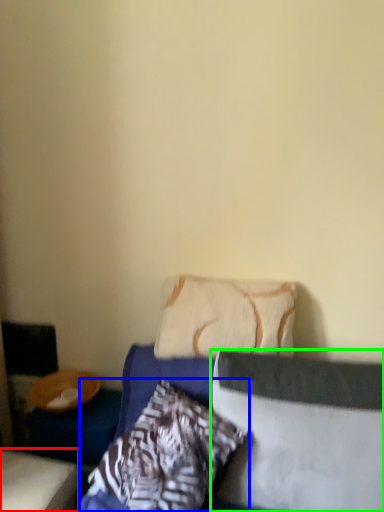
Question: Based on their relative distances, which object is nearer to furniture (highlighted by a red box)? Choose from pillow (highlighted by a blue box) and pillow (highlighted by a green box).

Choices:
 (A) pillow
 (B) pillow

Answer: (A)